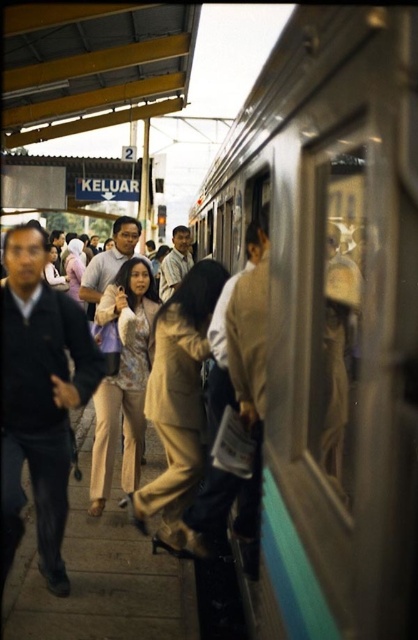
Looking at this image, is silver metallic train at center further to the viewer compared to tan fabric pants at center?

No, it is in front of tan fabric pants at center.

This screenshot has width=418, height=640. What are the coordinates of `silver metallic train at center` in the screenshot? It's located at (331, 317).

Who is more forward, (288, 472) or (162, 529)?

Point (288, 472) is in front.

Identify the location of silver metallic train at center. The height and width of the screenshot is (640, 418). (331, 317).

Does dark blue fabric jacket at left have a greater width compared to tan fabric pants at center?

Incorrect, dark blue fabric jacket at left's width does not surpass tan fabric pants at center's.

The height and width of the screenshot is (640, 418). What do you see at coordinates (40, 397) in the screenshot?
I see `dark blue fabric jacket at left` at bounding box center [40, 397].

Which is in front, point (23, 237) or point (180, 356)?

Point (23, 237) is in front.

Find the location of a particular element. This screenshot has width=418, height=640. dark blue fabric jacket at left is located at coordinates (40, 397).

Is silver metallic train at center positioned before dark blue fabric jacket at left?

Yes.

Is silver metallic train at center thinner than dark blue fabric jacket at left?

In fact, silver metallic train at center might be wider than dark blue fabric jacket at left.

Where is `silver metallic train at center`? Image resolution: width=418 pixels, height=640 pixels. silver metallic train at center is located at coordinates (331, 317).